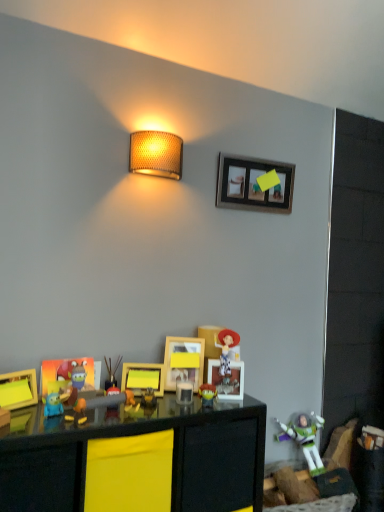
The image size is (384, 512). What are the coordinates of `vacant area on the back side of matte blue toy at lower left, marked as the second toy in a top-to-bottom arrangement` in the screenshot? It's located at (69, 406).